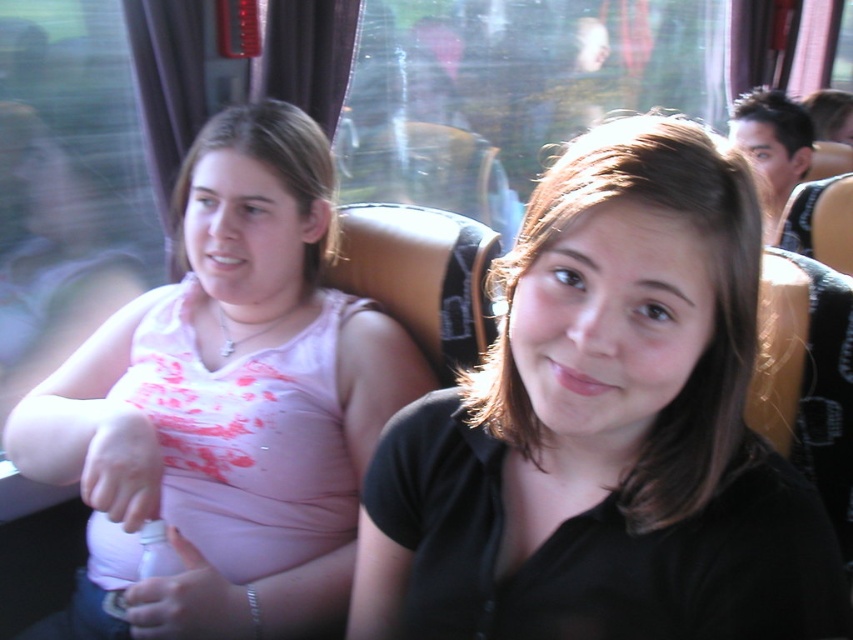
You are a photographer trying to capture a group photo of the black matte shirt at center and the pink matte tank top at center. Which person should you ask to move closer to the camera to make them appear the same size in the photo?

The black matte shirt at center is smaller than the pink matte tank top at center, so you should ask the black matte shirt at center to move closer to the camera to balance their sizes in the photo.

You are standing at the front of the bus and see the point marked at coordinates (x=605, y=428). What object is located at that point?

The point at coordinates (x=605, y=428) marks the black matte shirt at center.

You are sitting in the middle of the bus and want to hand a note to both the black matte shirt at center and the pink matte tank top at center. Which person should you hand the note to first to reach them in the correct order based on their proximity to you?

You should hand the note to the black matte shirt at center first because they are closer to you than the pink matte tank top at center.